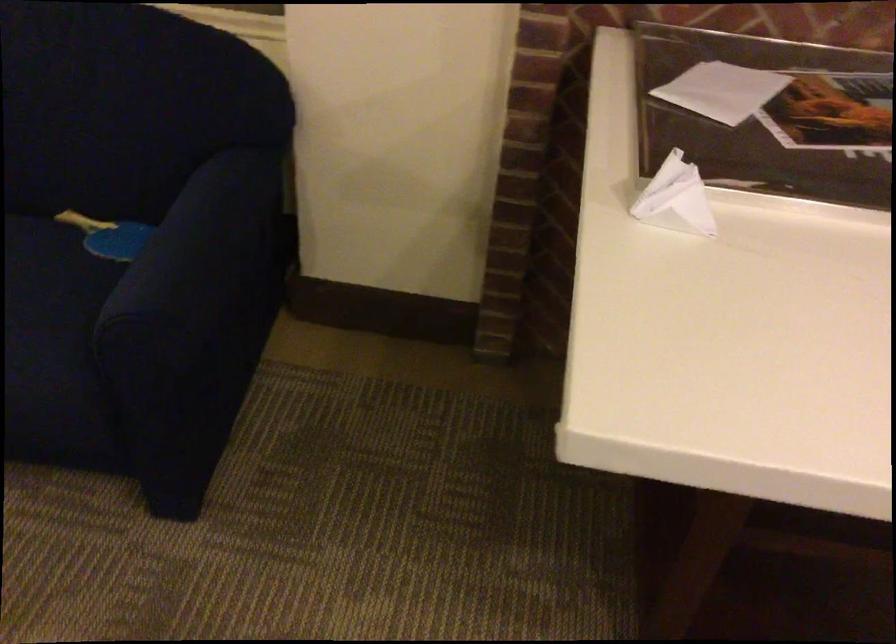
The height and width of the screenshot is (644, 896). What do you see at coordinates (771, 117) in the screenshot?
I see `the dark picture frame` at bounding box center [771, 117].